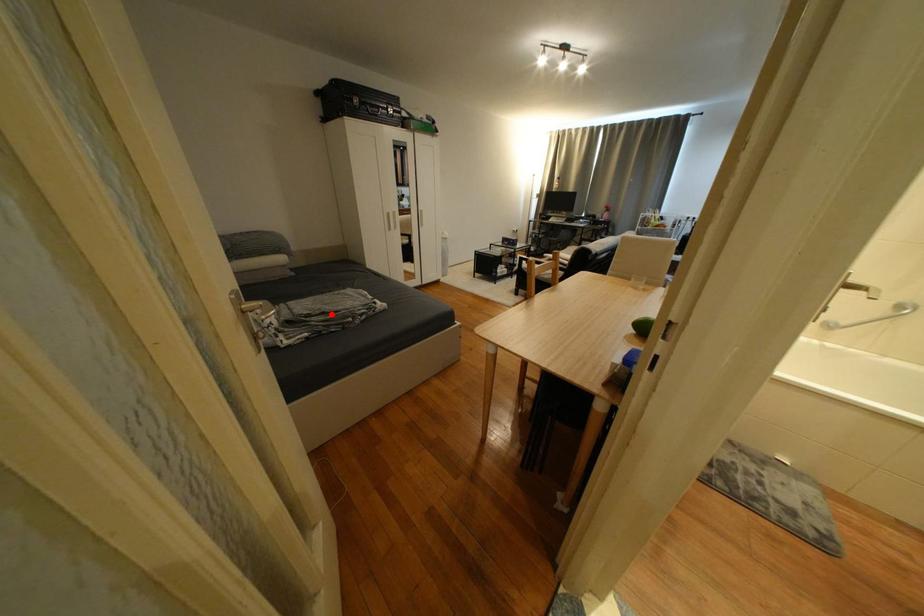
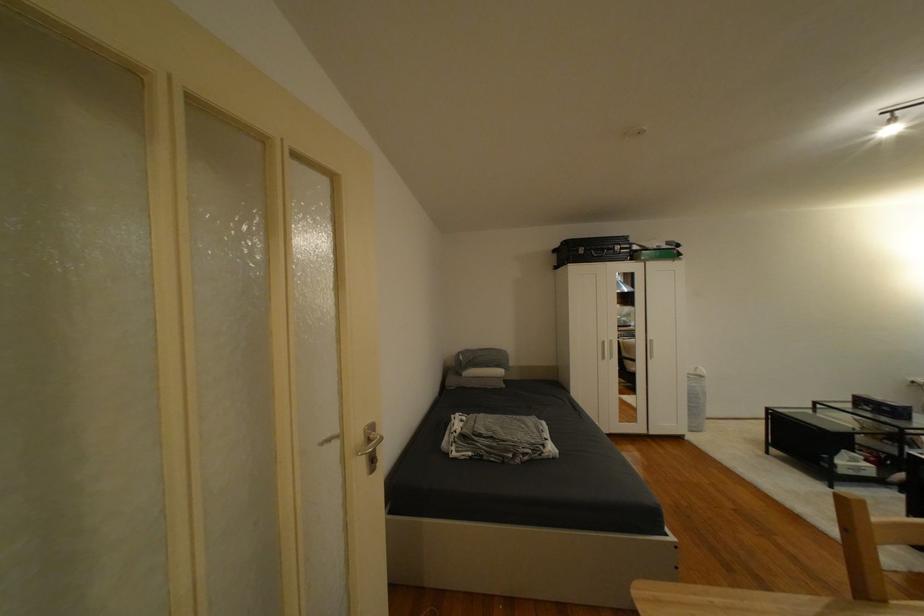
Find the pixel in the second image that matches the highlighted location in the first image.

(500, 439)